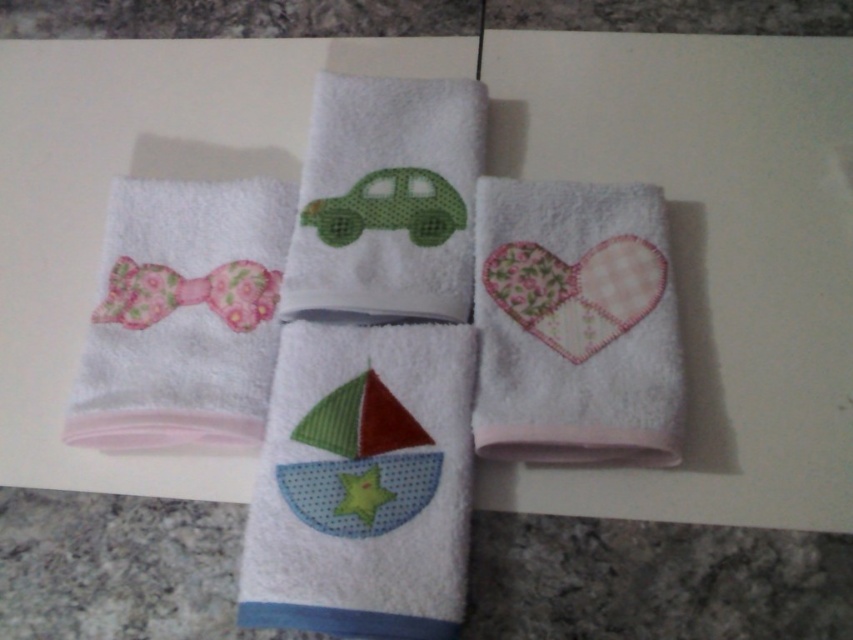
Question: Among these points, which one is farthest from the camera?

Choices:
 (A) (314, 244)
 (B) (264, 317)
 (C) (641, 337)

Answer: (A)

Question: Which object appears farthest from the camera in this image?

Choices:
 (A) floral fabric bow tie at left
 (B) pink fabric bow at upper left
 (C) green textured car at center
 (D) patchwork heart at center

Answer: (A)

Question: Which point is closer to the camera?

Choices:
 (A) floral fabric bow tie at left
 (B) pink fabric bow at upper left
 (C) green textured car at center
 (D) patchwork heart at center

Answer: (D)

Question: Is green textured car at center to the left of floral fabric bow tie at left from the viewer's perspective?

Choices:
 (A) no
 (B) yes

Answer: (A)

Question: Observing the image, what is the correct spatial positioning of white soft sailboat at center in reference to pink fabric bow at upper left?

Choices:
 (A) below
 (B) above

Answer: (A)

Question: In this image, where is green textured car at center located relative to floral fabric bow tie at left?

Choices:
 (A) right
 (B) left

Answer: (A)